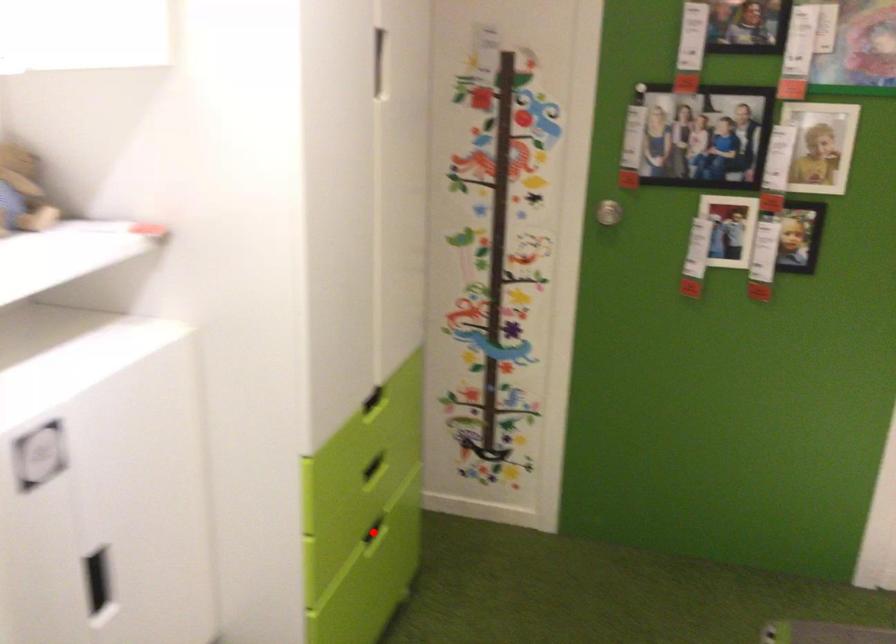
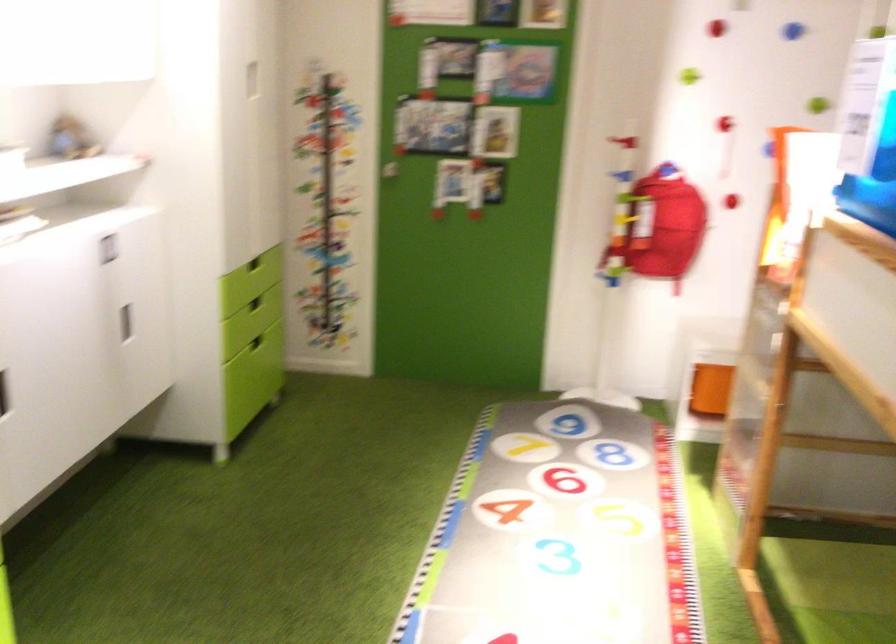
Question: A red point is marked in image1. In image2, is the corresponding 3D point closer to the camera or farther? Reply with the corresponding letter.

Choices:
 (A) The corresponding 3D point is closer.
 (B) The corresponding 3D point is farther.

Answer: (B)